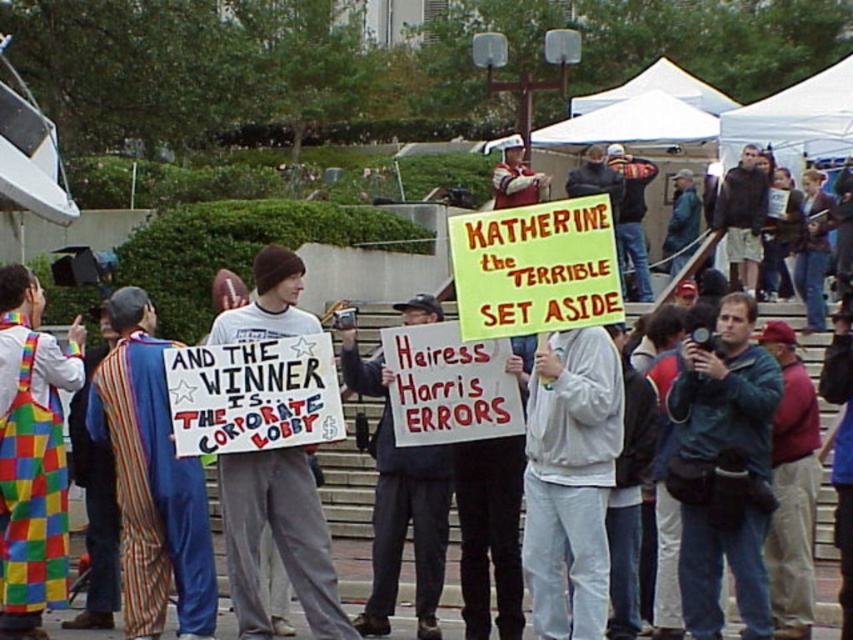
Question: Is multicolored checkered apron at left to the right of white paper sign at center from the viewer's perspective?

Choices:
 (A) no
 (B) yes

Answer: (A)

Question: Which point is farther to the camera?

Choices:
 (A) (245, 522)
 (B) (132, 483)

Answer: (B)

Question: Can you confirm if multicolored checkered apron at left is positioned to the right of white paper sign at center?

Choices:
 (A) yes
 (B) no

Answer: (B)

Question: Which object is positioned closest to the white paper sign at center?

Choices:
 (A) multicolored checkered apron at left
 (B) striped fabric cape at left

Answer: (B)

Question: Is multicolored checkered apron at left thinner than white paper sign at center?

Choices:
 (A) no
 (B) yes

Answer: (B)

Question: Which point is farther to the camera?

Choices:
 (A) click(x=268, y=285)
 (B) click(x=4, y=436)

Answer: (B)